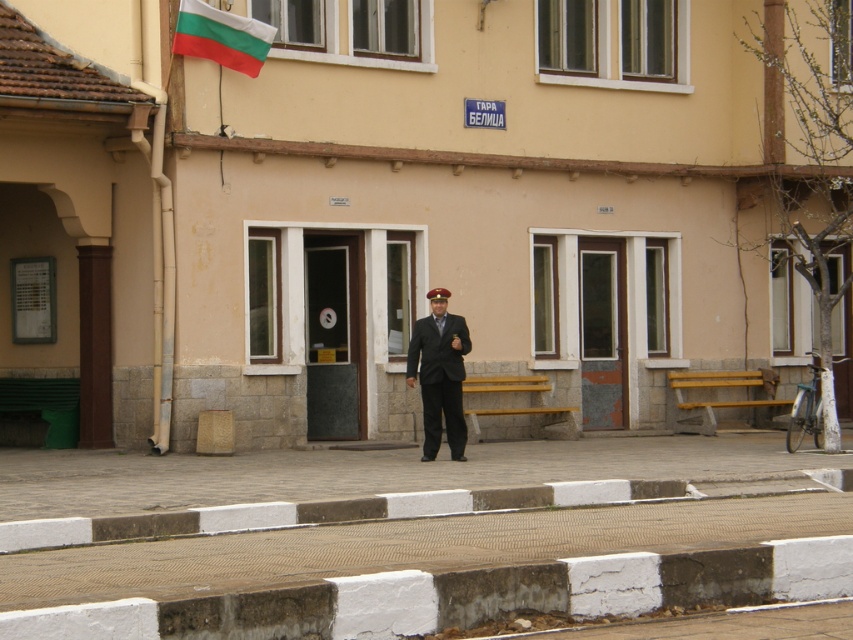
A person wearing a dark suit at center is standing in front of a building. The building has a beige facade with a tiled roof. There are two wooden benches and a bicycle nearby. If the person wants to walk straight towards the beige facade, which direction should they move relative to their current position?

The person wearing the dark suit at center should move towards the beige facade, which is located behind them relative to their position at point (439,372).

You are a delivery person who needs to leave a package at the building. You see a dark suit at center and a bulgarian flag at upper left. How far apart are these two objects?

The dark suit at center and the bulgarian flag at upper left are 4.56 meters apart from each other.